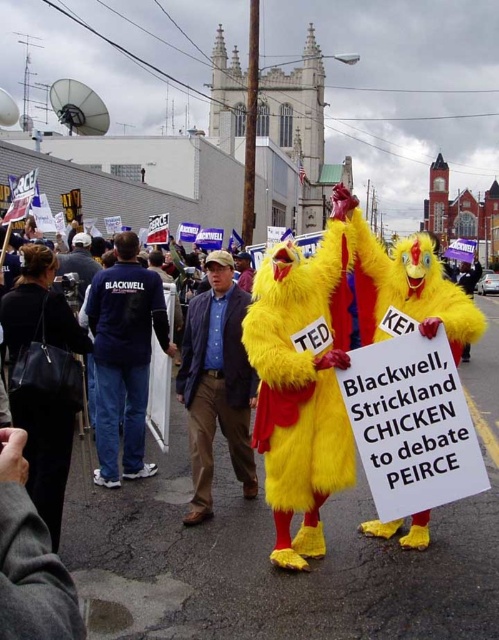
Question: Is blue denim shirt at center positioned in front of blue cotton shirt at center?

Choices:
 (A) no
 (B) yes

Answer: (B)

Question: Does blue denim shirt at center appear on the left side of blue cotton shirt at center?

Choices:
 (A) yes
 (B) no

Answer: (B)

Question: Among these objects, which one is nearest to the camera?

Choices:
 (A) blue cotton shirt at center
 (B) blue denim shirt at center

Answer: (B)

Question: Is blue denim shirt at center positioned before blue cotton shirt at center?

Choices:
 (A) yes
 (B) no

Answer: (A)